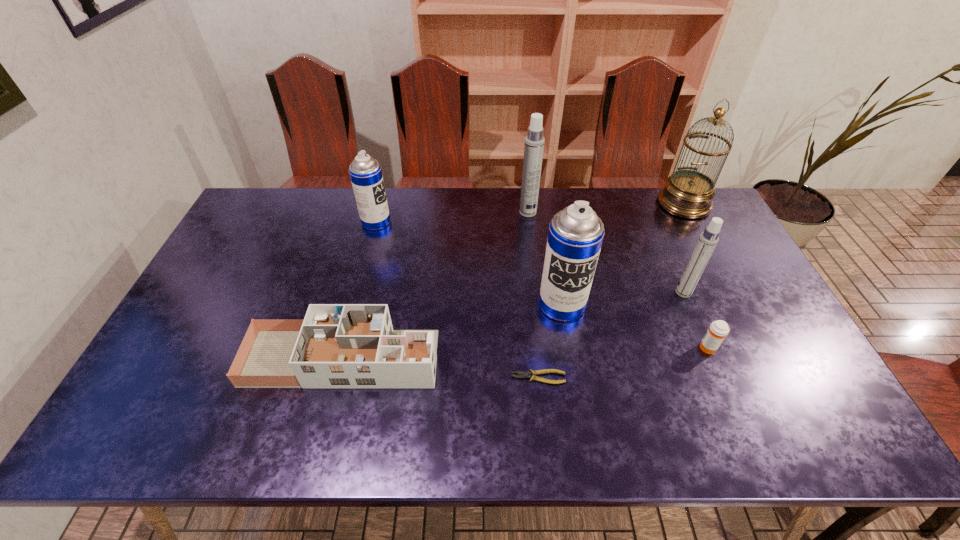
In order to click on vacant area situated on the back of the medicine in this screenshot , I will do `click(674, 267)`.

Identify the location of blank area located 0.320m on the left of the shortest object. This screenshot has height=540, width=960. (381, 377).

At what (x,y) coordinates should I click in order to perform the action: click on birdcage that is positioned at the far edge. Please return your answer as a coordinate pair (x, y). Looking at the image, I should click on (687, 193).

Find the location of `object located in the right edge section of the desktop`. object located in the right edge section of the desktop is located at coordinates (687, 193).

Identify the location of object that is at the far right corner. (687, 193).

At what (x,y) coordinates should I click in order to perform the action: click on vacant area at the far edge of the desktop. Please return your answer as a coordinate pair (x, y). The height and width of the screenshot is (540, 960). Looking at the image, I should click on (448, 216).

Where is `free space at the near edge of the desktop`? free space at the near edge of the desktop is located at coordinates (637, 420).

In the image, there is a desktop. Where is `free space at the left edge`? The width and height of the screenshot is (960, 540). free space at the left edge is located at coordinates (259, 231).

The height and width of the screenshot is (540, 960). What are the coordinates of `free space at the right edge of the desktop` in the screenshot? It's located at (732, 273).

At what (x,y) coordinates should I click in order to perform the action: click on free space at the far left corner of the desktop. Please return your answer as a coordinate pair (x, y). Image resolution: width=960 pixels, height=540 pixels. Looking at the image, I should click on (269, 203).